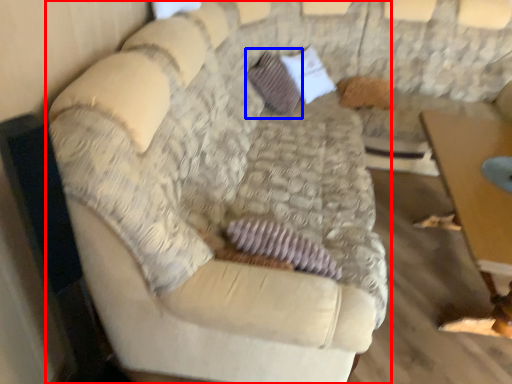
Question: Among these objects, which one is farthest to the camera, studio couch (highlighted by a red box) or pillow (highlighted by a blue box)?

Choices:
 (A) studio couch
 (B) pillow

Answer: (B)